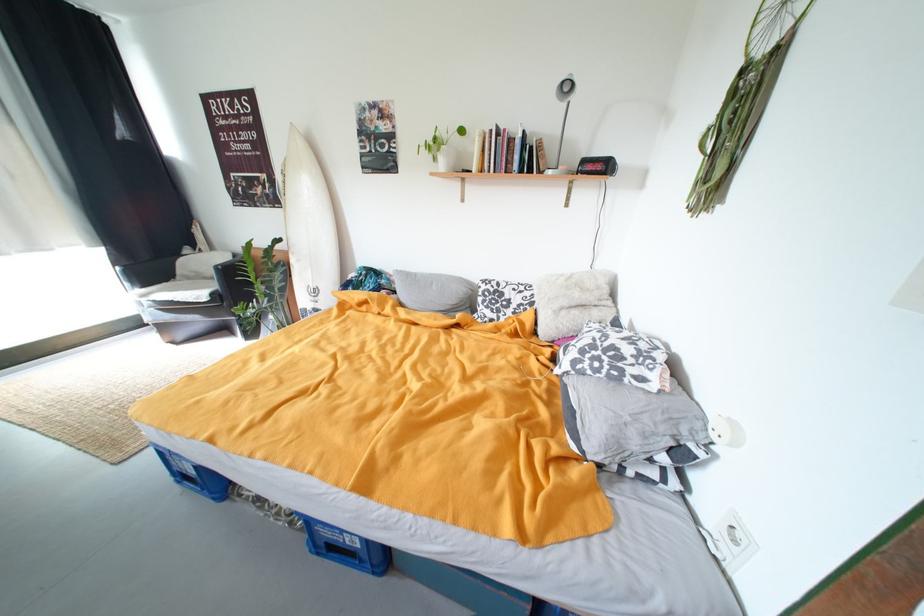
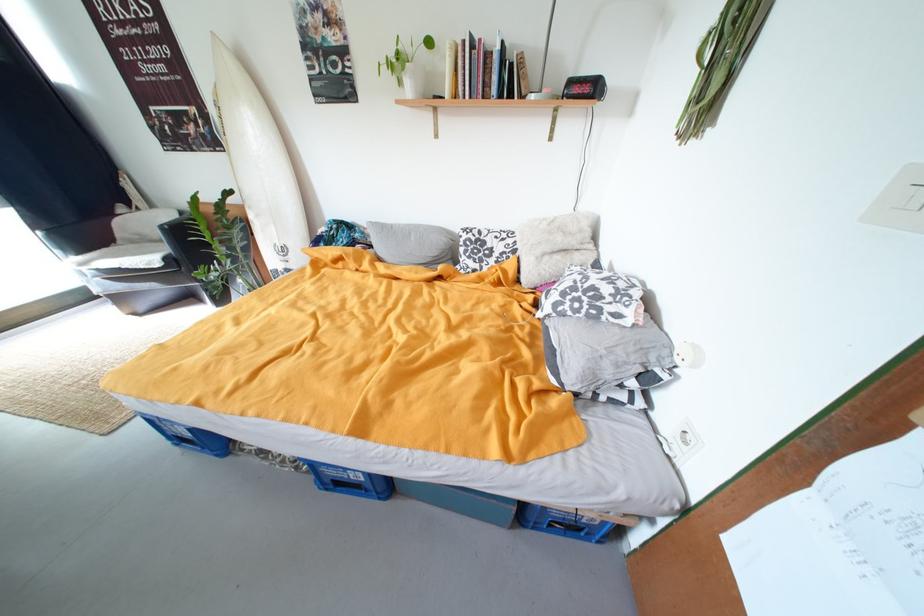
The point at (739, 530) is marked in the first image. Where is the corresponding point in the second image?

(693, 434)